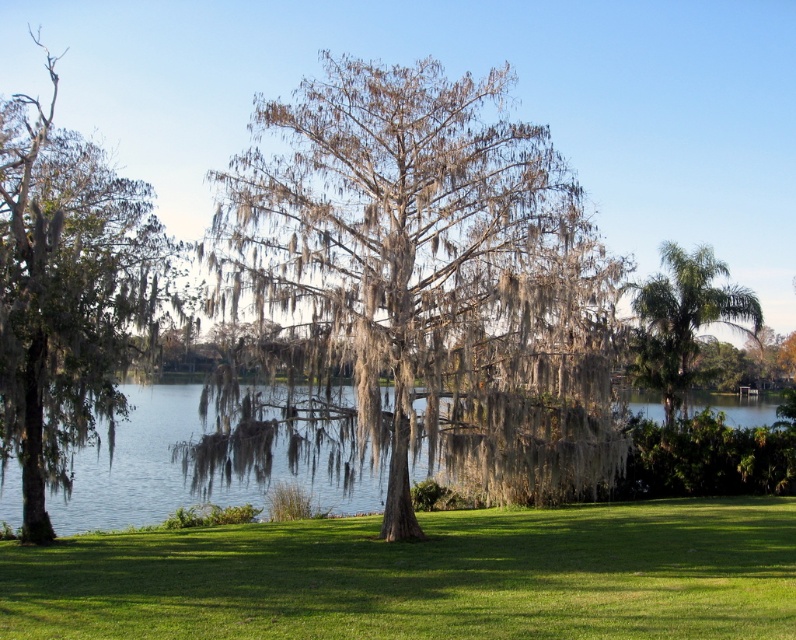
Is green mossy tree at left smaller than green leafy palm at right?

Actually, green mossy tree at left might be larger than green leafy palm at right.

Is green mossy tree at left taller than green leafy palm at right?

Indeed, green mossy tree at left has a greater height compared to green leafy palm at right.

Image resolution: width=796 pixels, height=640 pixels. What do you see at coordinates (67, 294) in the screenshot?
I see `green mossy tree at left` at bounding box center [67, 294].

Locate an element on the screen. This screenshot has width=796, height=640. green mossy tree at left is located at coordinates (67, 294).

Between green grass at center and green mossy tree at left, which one has less height?

Standing shorter between the two is green grass at center.

Who is more distant from viewer, [540,509] or [0,432]?

Positioned behind is point [540,509].

The height and width of the screenshot is (640, 796). Find the location of `green grass at center`. green grass at center is located at coordinates (424, 577).

Does clear water at center appear on the left side of green leafy palm at right?

Correct, you'll find clear water at center to the left of green leafy palm at right.

Who is positioned more to the right, clear water at center or green leafy palm at right?

green leafy palm at right

Locate an element on the screen. clear water at center is located at coordinates (181, 470).